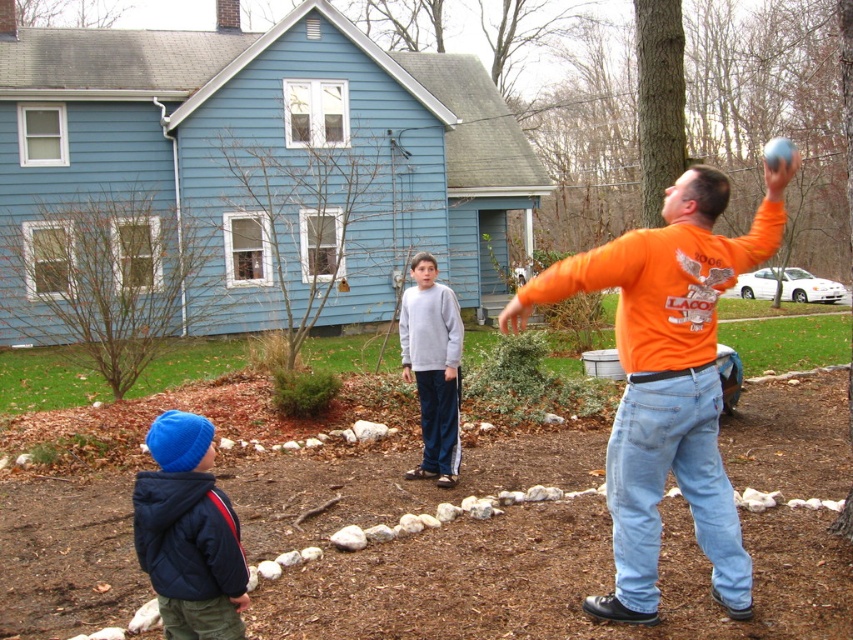
Question: Which point is closer to the camera taking this photo?

Choices:
 (A) (198, 435)
 (B) (721, 209)

Answer: (A)

Question: Observing the image, what is the correct spatial positioning of matte blue beanie at lower left in reference to gray sweatshirt at center?

Choices:
 (A) below
 (B) above

Answer: (A)

Question: Can you confirm if orange cotton shirt at right is wider than gray sweatshirt at center?

Choices:
 (A) no
 (B) yes

Answer: (B)

Question: Does orange cotton shirt at right have a greater width compared to matte blue beanie at lower left?

Choices:
 (A) no
 (B) yes

Answer: (B)

Question: Which point is farther to the camera?

Choices:
 (A) (718, 400)
 (B) (177, 445)
 (C) (436, 340)

Answer: (C)

Question: Which is nearer to the gray sweatshirt at center?

Choices:
 (A) orange cotton shirt at right
 (B) matte blue beanie at lower left

Answer: (A)